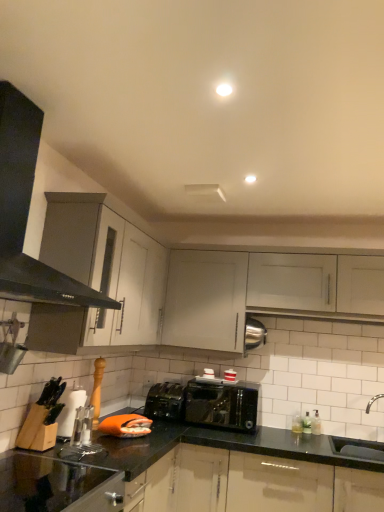
Question: Looking at the image, does white ceramic sink at lower right, which appears as the second sink when ordered from the bottom, seem bigger or smaller compared to matte black toaster at center?

Choices:
 (A) small
 (B) big

Answer: (B)

Question: Is point (375, 454) closer or farther from the camera than point (162, 389)?

Choices:
 (A) farther
 (B) closer

Answer: (B)

Question: Estimate the real-world distances between objects in this image. Which object is closer to the white ceramic sink at lower right, which appears as the second sink when ordered from the bottom?

Choices:
 (A) white matte cabinet at upper center, the 2th cabinetry viewed from the left
 (B) black granite countertop at lower left
 (C) white matte cabinet at upper center, arranged as the second cabinetry when viewed from the right
 (D) matte black toaster at center
 (E) white glossy sink at lower right, positioned as the second sink in top-to-bottom order

Answer: (E)

Question: Which object is the farthest from the white ceramic sink at lower right, which appears as the first sink when viewed from the top?

Choices:
 (A) white matte cabinet at upper center, arranged as the second cabinetry when viewed from the right
 (B) black matte exhaust hood at left
 (C) shiny black toaster at center
 (D) white matte cabinet at upper center, the 2th cabinetry viewed from the left
 (E) matte black toaster at center

Answer: (B)